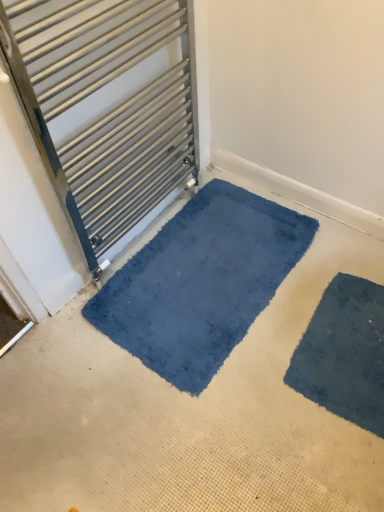
Image resolution: width=384 pixels, height=512 pixels. Identify the location of free space above blue plush mat at lower center (from a real-world perspective). (206, 262).